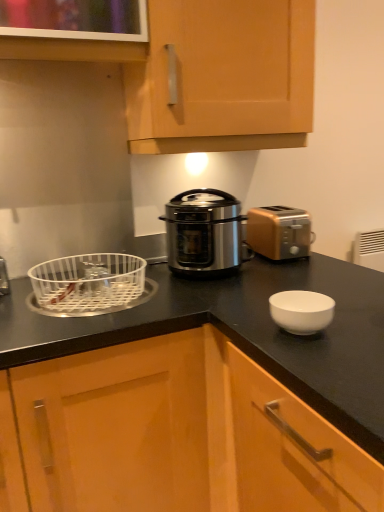
Question: Is wooden cabinet at center, which ranks as the 2th cabinetry in top-to-bottom order, inside gold metallic toaster at right?

Choices:
 (A) no
 (B) yes

Answer: (A)

Question: Considering the relative positions of gold metallic toaster at right and wooden cabinet at center, which ranks as the 2th cabinetry in top-to-bottom order, in the image provided, is gold metallic toaster at right to the right of wooden cabinet at center, which ranks as the 2th cabinetry in top-to-bottom order, from the viewer's perspective?

Choices:
 (A) yes
 (B) no

Answer: (B)

Question: Is gold metallic toaster at right directly adjacent to wooden cabinet at center, which ranks as the 2th cabinetry in top-to-bottom order?

Choices:
 (A) yes
 (B) no

Answer: (B)

Question: Is gold metallic toaster at right not inside wooden cabinet at center, arranged as the 1th cabinetry when ordered from the bottom?

Choices:
 (A) no
 (B) yes

Answer: (B)

Question: From a real-world perspective, is gold metallic toaster at right under wooden cabinet at center, arranged as the 1th cabinetry when ordered from the bottom?

Choices:
 (A) yes
 (B) no

Answer: (B)

Question: Does point (301, 251) appear closer or farther from the camera than point (213, 195)?

Choices:
 (A) closer
 (B) farther

Answer: (B)

Question: Is gold metallic toaster at right wider or thinner than stainless steel pressure cooker at center?

Choices:
 (A) thin
 (B) wide

Answer: (B)

Question: Based on their positions, is gold metallic toaster at right located to the left or right of stainless steel pressure cooker at center?

Choices:
 (A) left
 (B) right

Answer: (B)

Question: From their relative heights in the image, would you say gold metallic toaster at right is taller or shorter than stainless steel pressure cooker at center?

Choices:
 (A) tall
 (B) short

Answer: (B)

Question: Is light wood cabinet at upper center, positioned as the second cabinetry in bottom-to-top order, inside or outside of gold metallic toaster at right?

Choices:
 (A) inside
 (B) outside

Answer: (B)

Question: Looking at the image, does light wood cabinet at upper center, positioned as the second cabinetry in bottom-to-top order, seem bigger or smaller compared to gold metallic toaster at right?

Choices:
 (A) small
 (B) big

Answer: (B)

Question: Considering the positions of point (165, 4) and point (268, 223), is point (165, 4) closer or farther from the camera than point (268, 223)?

Choices:
 (A) farther
 (B) closer

Answer: (B)

Question: Is light wood cabinet at upper center, positioned as the second cabinetry in bottom-to-top order, in front of or behind gold metallic toaster at right in the image?

Choices:
 (A) behind
 (B) front

Answer: (B)

Question: Looking at their shapes, would you say white plastic basket at left is wider or thinner than wooden cabinet at center, which ranks as the 2th cabinetry in top-to-bottom order?

Choices:
 (A) thin
 (B) wide

Answer: (A)

Question: In terms of size, does white plastic basket at left appear bigger or smaller than wooden cabinet at center, which ranks as the 2th cabinetry in top-to-bottom order?

Choices:
 (A) small
 (B) big

Answer: (A)